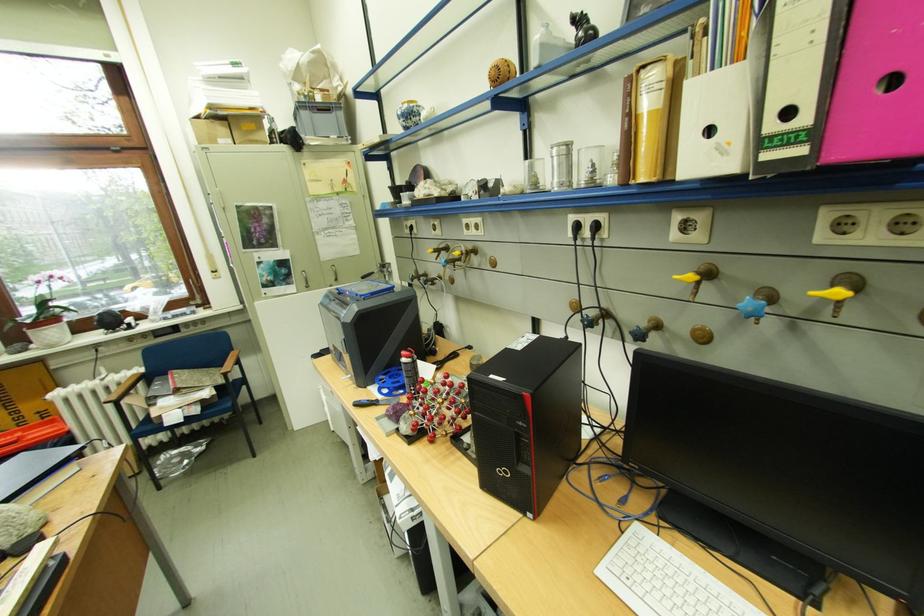
Where would you pull the pink binder hole? Please return your answer as a coordinate pair (x, y).

(888, 61)